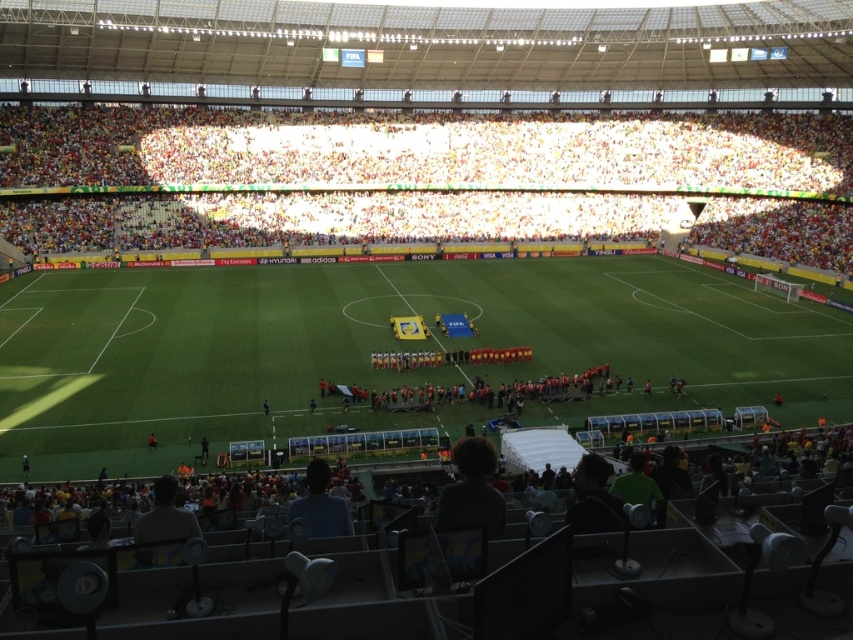
Can you confirm if green grass football field at center is thinner than white fabric crowd at upper center?

Yes, green grass football field at center is thinner than white fabric crowd at upper center.

Measure the distance between green grass football field at center and camera.

green grass football field at center is 109.45 feet from camera.

Measure the distance between point (119, 317) and camera.

Point (119, 317) is 59.11 meters away from camera.

Where is `green grass football field at center`? The image size is (853, 640). green grass football field at center is located at coordinates (376, 348).

Can you confirm if white fabric crowd at upper center is positioned above dark green jersey at lower right?

Correct, white fabric crowd at upper center is located above dark green jersey at lower right.

In the scene shown: Can you confirm if white fabric crowd at upper center is positioned to the right of dark green jersey at lower right?

In fact, white fabric crowd at upper center is to the left of dark green jersey at lower right.

Between point (828, 147) and point (583, 467), which one is positioned behind?

The point (828, 147) is more distant.

Identify the location of white fabric crowd at upper center. This screenshot has width=853, height=640. (142, 144).

Does dark gray shirt at lower left have a greater width compared to dark blue shirt at lower center?

Correct, the width of dark gray shirt at lower left exceeds that of dark blue shirt at lower center.

Does dark gray shirt at lower left appear on the left side of dark blue shirt at lower center?

Indeed, dark gray shirt at lower left is positioned on the left side of dark blue shirt at lower center.

In order to click on dark gray shirt at lower left in this screenshot , I will do `click(163, 525)`.